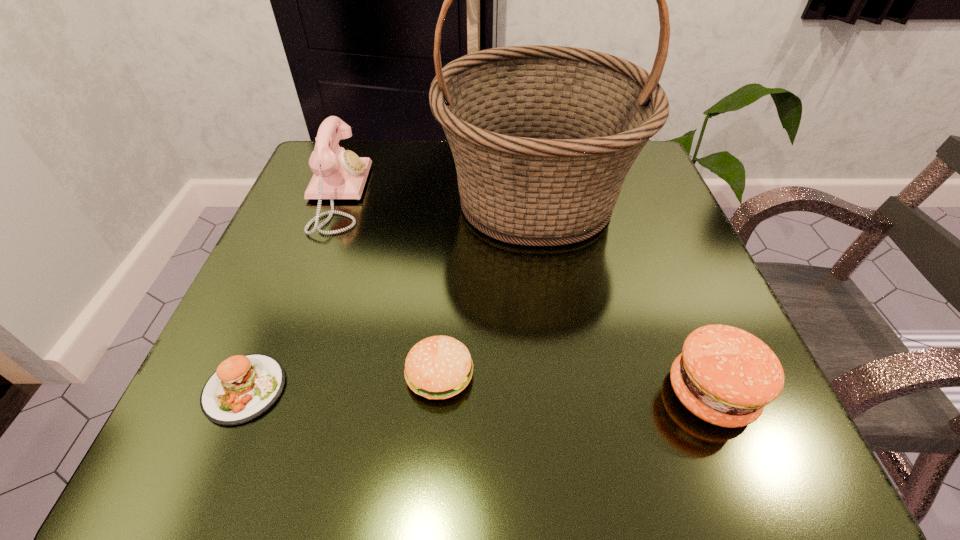
Select which patty appears as the second closest to the shortest object. Please provide its 2D coordinates. Your answer should be formatted as a tuple, i.e. [(x, y)], where the tuple contains the x and y coordinates of a point satisfying the conditions above.

[(725, 376)]

The image size is (960, 540). Identify the location of blank area in the image that satisfies the following two spatial constraints: 1. on the dial of the fourth shortest object; 2. on the back side of the tallest patty. (261, 393).

Where is `vacant area that satisfies the following two spatial constraints: 1. on the dial of the second tallest object; 2. on the right side of the second tallest patty`? This screenshot has height=540, width=960. vacant area that satisfies the following two spatial constraints: 1. on the dial of the second tallest object; 2. on the right side of the second tallest patty is located at coordinates (268, 374).

At what (x,y) coordinates should I click in order to perform the action: click on free space in the image that satisfies the following two spatial constraints: 1. on the dial of the telephone; 2. on the left side of the third tallest object. Please return your answer as a coordinate pair (x, y). The width and height of the screenshot is (960, 540). Looking at the image, I should click on (x=261, y=393).

Identify the location of vacant space that satisfies the following two spatial constraints: 1. on the back side of the second shortest patty; 2. on the dial of the second tallest object. (453, 195).

Where is `free space that satisfies the following two spatial constraints: 1. on the dial of the second tallest object; 2. on the back side of the tallest object`? Image resolution: width=960 pixels, height=540 pixels. free space that satisfies the following two spatial constraints: 1. on the dial of the second tallest object; 2. on the back side of the tallest object is located at coordinates (335, 199).